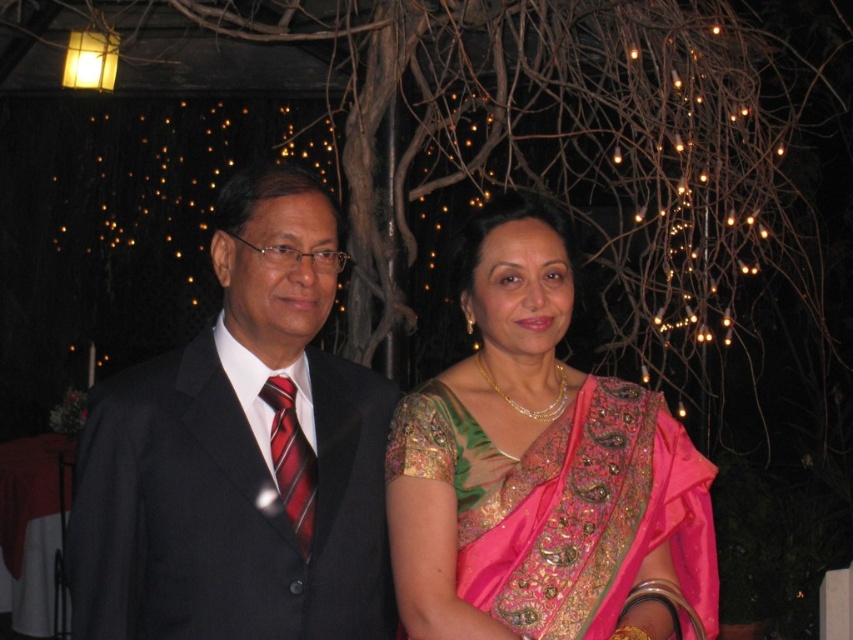
You are a photographer at an event and want to capture a closeup of the red striped tie at left and the pink embroidered saree at center. Which object should you focus on first if you want to ensure both are in focus without moving the camera?

The red striped tie at left is closer to the camera than the pink embroidered saree at center, so you should focus on the red striped tie at left first to ensure both are in focus.